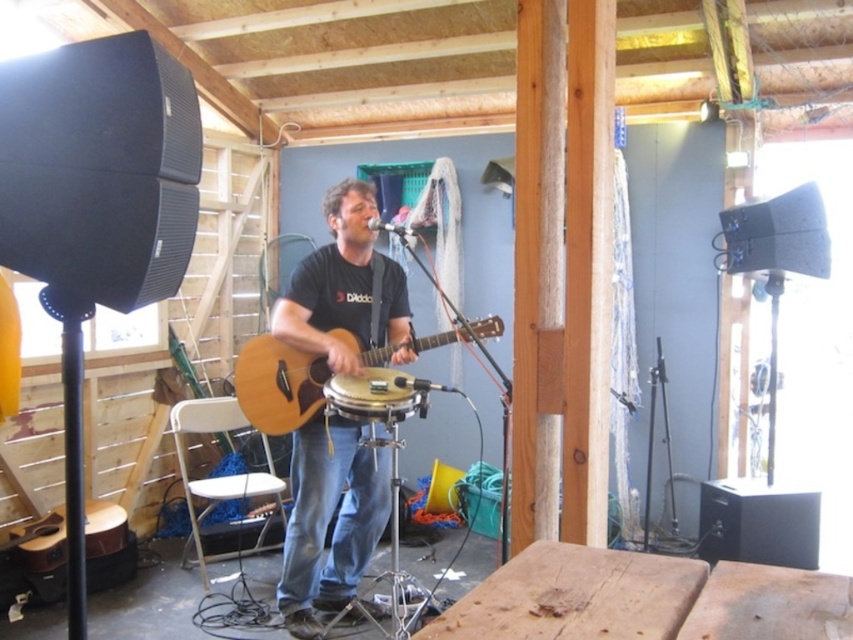
You are a photographer setting up for a live performance. You need to position your camera so that both the natural wood acoustic guitar at center and the matte black drum at center are visible in the frame. Which object should you ensure is closer to the camera to include both in the shot?

The matte black drum at center is behind the natural wood acoustic guitar at center, so to include both in the frame, the camera should be positioned closer to the natural wood acoustic guitar at center.

In the scene shown: You are a photographer trying to capture the best angle of the man playing music. You notice two points in the scene at coordinates point (253, 413) and point (364, 396). Which point is closer to you?

Point (253, 413) is further to the viewer than point (364, 396), so the closer point to you is point (364, 396).